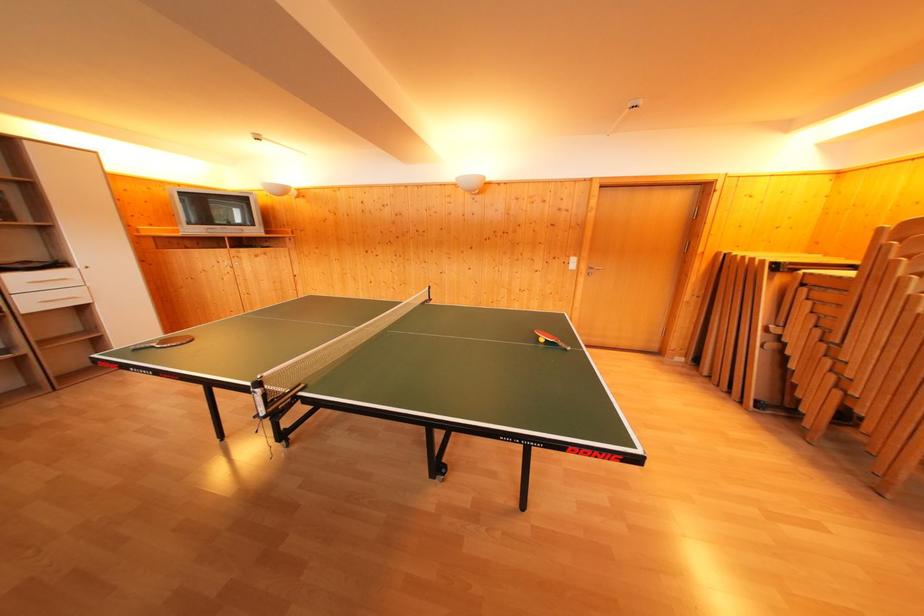
This screenshot has width=924, height=616. Describe the element at coordinates (592, 269) in the screenshot. I see `the silver door handle` at that location.